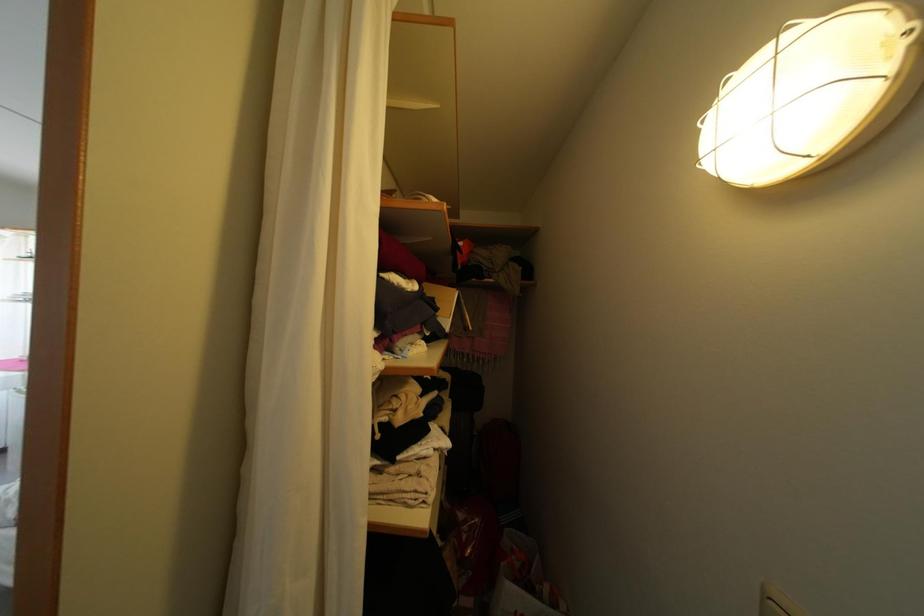
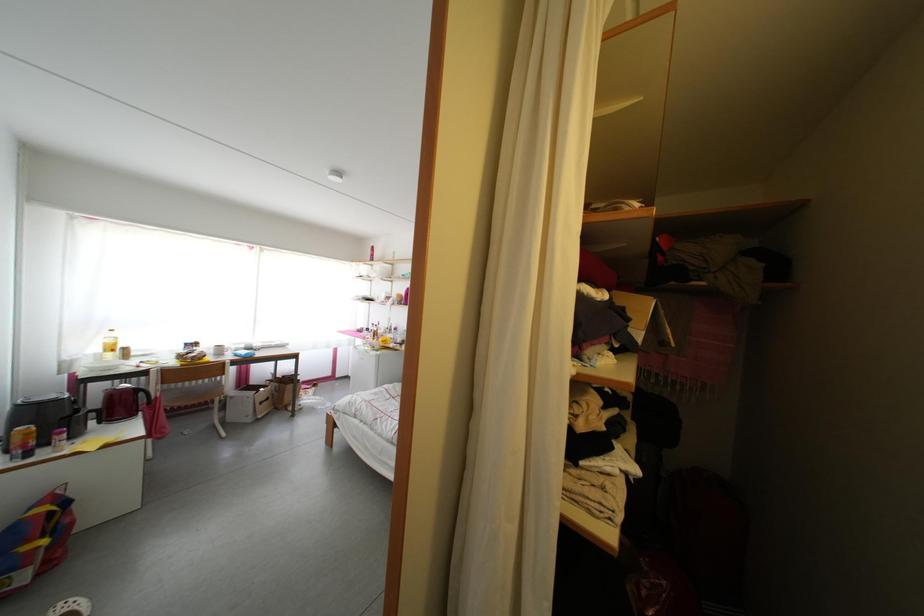
Question: The camera is either moving clockwise (left) or counter-clockwise (right) around the object. The first image is from the beginning of the video and the second image is from the end. Is the camera moving left or right when shooting the video?

Choices:
 (A) Left
 (B) Right

Answer: (B)